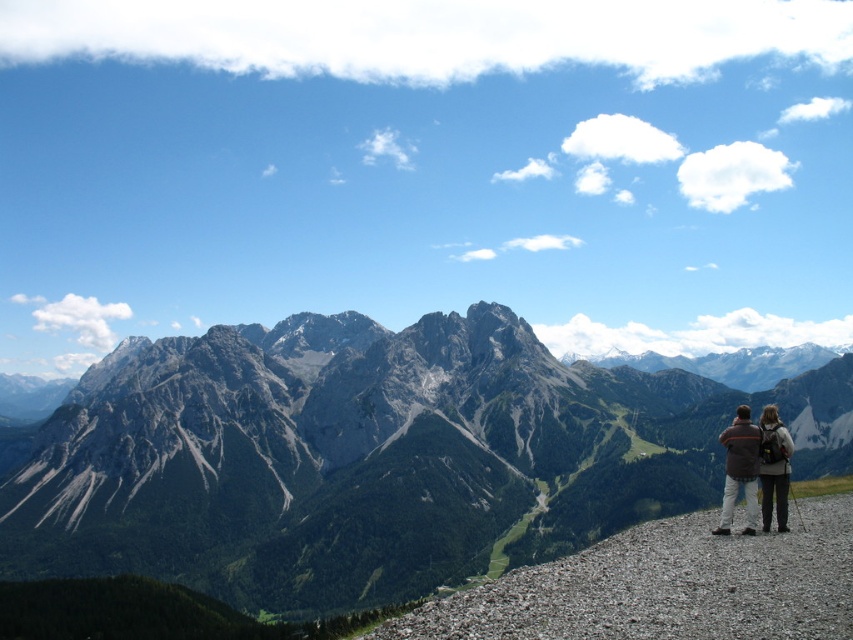
Question: Which of these objects is positioned closest to the gray rocky mountain range at center?

Choices:
 (A) dark gray backpack at lower right
 (B) dark brown leather jacket at lower right

Answer: (B)

Question: Which point is farther to the camera?

Choices:
 (A) gray rocky mountain range at center
 (B) dark brown leather jacket at lower right
 (C) dark gray backpack at lower right

Answer: (A)

Question: Observing the image, what is the correct spatial positioning of gray rocky mountain range at center in reference to dark gray backpack at lower right?

Choices:
 (A) right
 (B) left

Answer: (B)

Question: Does gray rocky mountain range at center appear on the right side of dark gray backpack at lower right?

Choices:
 (A) no
 (B) yes

Answer: (A)

Question: Is gray rocky mountain range at center to the left of dark brown leather jacket at lower right from the viewer's perspective?

Choices:
 (A) no
 (B) yes

Answer: (B)

Question: Which point appears farthest from the camera in this image?

Choices:
 (A) (756, 468)
 (B) (741, 397)
 (C) (785, 445)

Answer: (B)